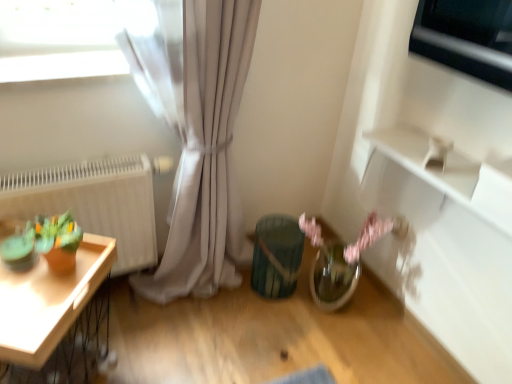
At what (x,y) coordinates should I click in order to perform the action: click on free space in front of teal textured vase at center. Please return your answer as a coordinate pair (x, y). Looking at the image, I should click on (270, 329).